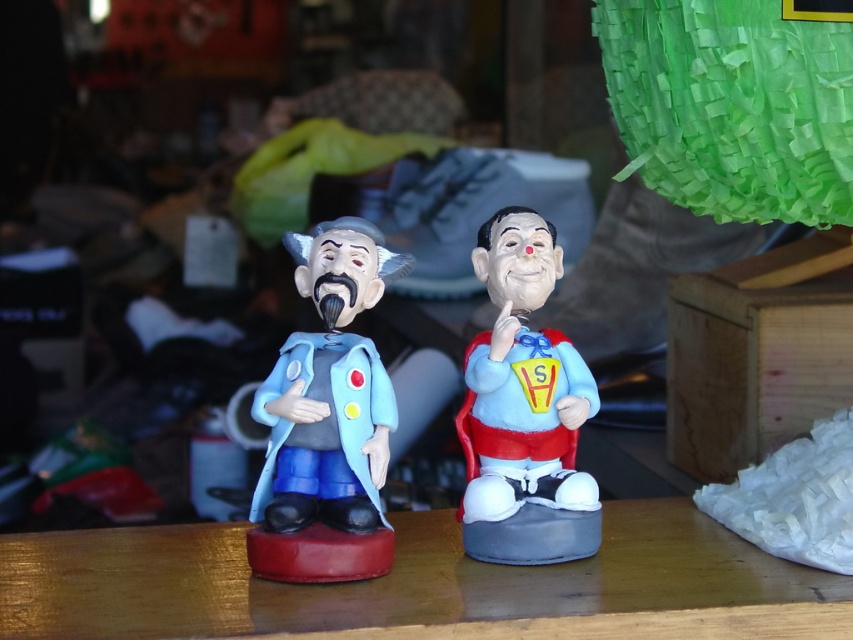
You are placing a new vase on the wooden table at center. However, there is already a matte clay figurine at center on the table. Can the vase be placed on the table without moving the existing figurine?

The wooden table at center is positioned under matte clay figurine at center, meaning the table is beneath the figurine. Since the table is already supporting the figurine, there should be enough space to place the vase alongside it unless the table is completely covered. However, without specific size details, we can assume the table has space. Therefore, yes, the vase can likely be placed on the wooden table at center without moving the existing matte clay figurine at center.

You are arranging items on the wooden table at center and the matte plastic clown at center. If you want to place a small vase between them, where should you position it?

The wooden table at center is to the left of the matte plastic clown at center, so you should place the small vase between them to the right of the wooden table at center and to the left of the matte plastic clown at center.

You are arranging items on a wooden table and notice two objects on it. The wooden table at center and the matte clay figurine at center. Which one is positioned to the right?

The wooden table at center is to the right of the matte clay figurine at center according to the description.